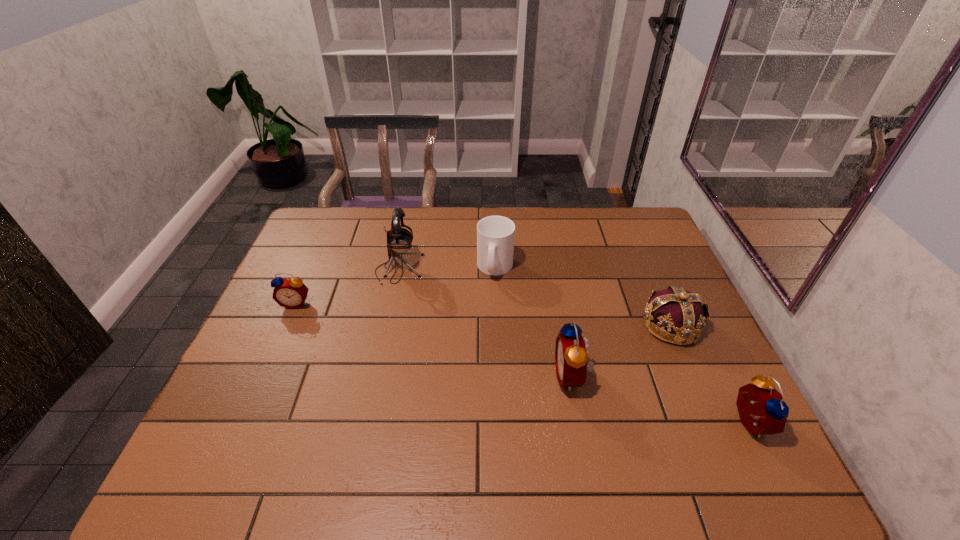
This screenshot has width=960, height=540. I want to click on alarm clock that is the second closest one to the crown, so click(571, 356).

The width and height of the screenshot is (960, 540). Identify the location of vacant region that satisfies the following two spatial constraints: 1. on the front-facing side of the farthest alarm clock; 2. on the right side of the crown. (286, 325).